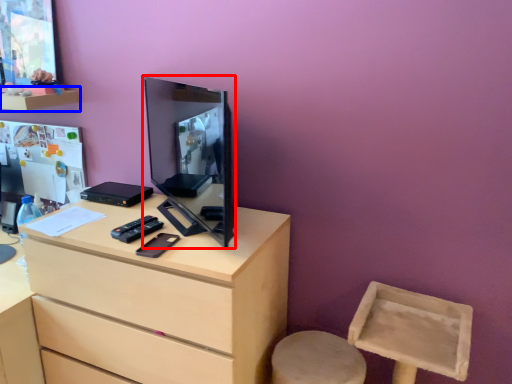
Question: Which object is further to the camera taking this photo, computer monitor (highlighted by a red box) or shelf (highlighted by a blue box)?

Choices:
 (A) computer monitor
 (B) shelf

Answer: (B)